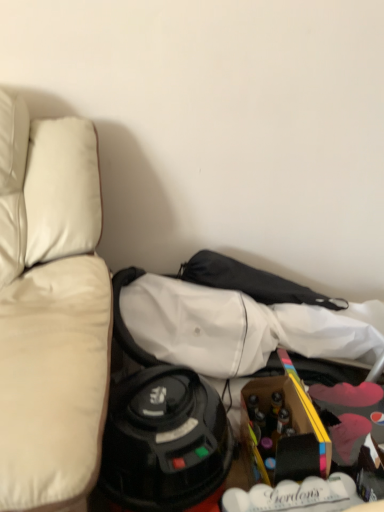
What is the approximate height of white fabric shirt at center?

It is 8.70 inches.

This screenshot has height=512, width=384. What are the coordinates of `white fabric shirt at center` in the screenshot? It's located at (242, 327).

Image resolution: width=384 pixels, height=512 pixels. Describe the element at coordinates (242, 327) in the screenshot. I see `white fabric shirt at center` at that location.

Find the location of a particular element. The height and width of the screenshot is (512, 384). white fabric shirt at center is located at coordinates (242, 327).